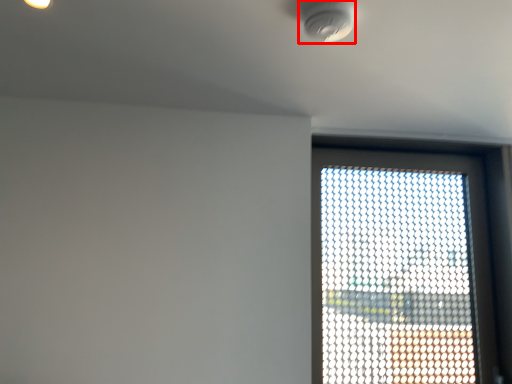
Question: From the image, what is the correct spatial relationship of light fixture (annotated by the red box) in relation to window?

Choices:
 (A) left
 (B) right

Answer: (A)